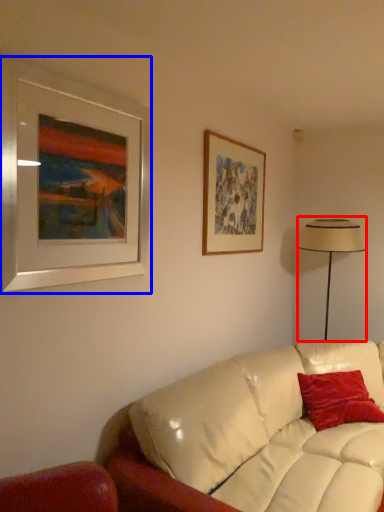
Question: Which object is further to the camera taking this photo, table lamp (highlighted by a red box) or picture frame (highlighted by a blue box)?

Choices:
 (A) table lamp
 (B) picture frame

Answer: (A)